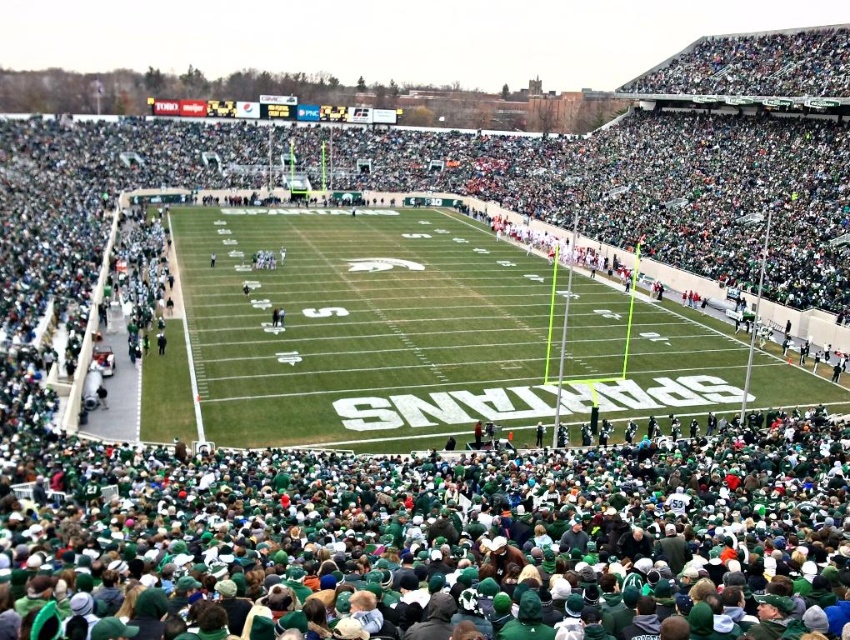
Does green fabric crowd at lower center have a smaller size compared to green grass football field at center?

Yes.

Who is more distant from viewer, (813,410) or (182,244)?

The point (182,244) is behind.

This screenshot has width=850, height=640. I want to click on green fabric crowd at lower center, so click(437, 538).